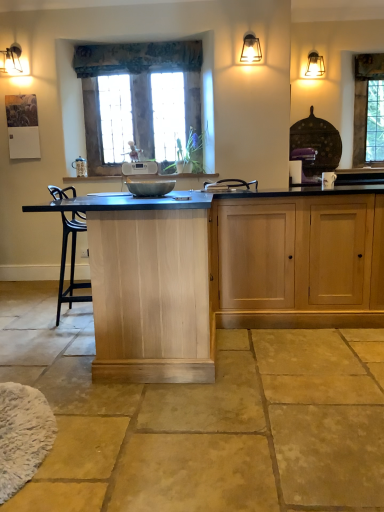
Question: Considering the relative sizes of matte black wall sconce at upper right and textured fabric curtain at upper center in the image provided, is matte black wall sconce at upper right taller than textured fabric curtain at upper center?

Choices:
 (A) no
 (B) yes

Answer: (A)

Question: Does matte black wall sconce at upper right come in front of textured fabric curtain at upper center?

Choices:
 (A) yes
 (B) no

Answer: (A)

Question: Is matte black wall sconce at upper right at the left side of textured fabric curtain at upper center?

Choices:
 (A) no
 (B) yes

Answer: (A)

Question: Is matte black wall sconce at upper right far from textured fabric curtain at upper center?

Choices:
 (A) no
 (B) yes

Answer: (A)

Question: Considering the relative sizes of matte black wall sconce at upper right and textured fabric curtain at upper center in the image provided, is matte black wall sconce at upper right shorter than textured fabric curtain at upper center?

Choices:
 (A) no
 (B) yes

Answer: (B)

Question: Is textured fabric curtain at upper center located within matte black wall sconce at upper right?

Choices:
 (A) no
 (B) yes

Answer: (A)

Question: Does natural wood cabinet at center have a lesser height compared to textured fabric curtain at upper center?

Choices:
 (A) yes
 (B) no

Answer: (B)

Question: Is textured fabric curtain at upper center completely or partially inside natural wood cabinet at center?

Choices:
 (A) yes
 (B) no

Answer: (B)

Question: From a real-world perspective, is natural wood cabinet at center below textured fabric curtain at upper center?

Choices:
 (A) yes
 (B) no

Answer: (A)

Question: Is natural wood cabinet at center far away from textured fabric curtain at upper center?

Choices:
 (A) yes
 (B) no

Answer: (A)

Question: Are natural wood cabinet at center and textured fabric curtain at upper center making contact?

Choices:
 (A) no
 (B) yes

Answer: (A)

Question: Can you confirm if natural wood cabinet at center is wider than textured fabric curtain at upper center?

Choices:
 (A) no
 (B) yes

Answer: (B)

Question: Can you confirm if clear glass window at upper right, marked as the 2th window in a front-to-back arrangement, is positioned to the left of natural stone floor at center?

Choices:
 (A) yes
 (B) no

Answer: (B)